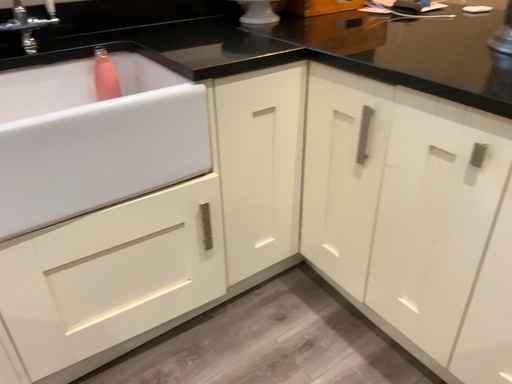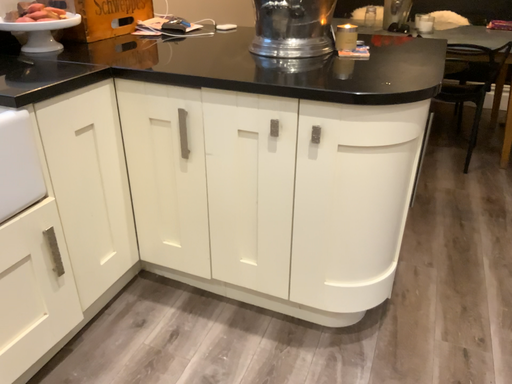
Question: How did the camera likely rotate when shooting the video?

Choices:
 (A) rotated right
 (B) rotated left

Answer: (A)